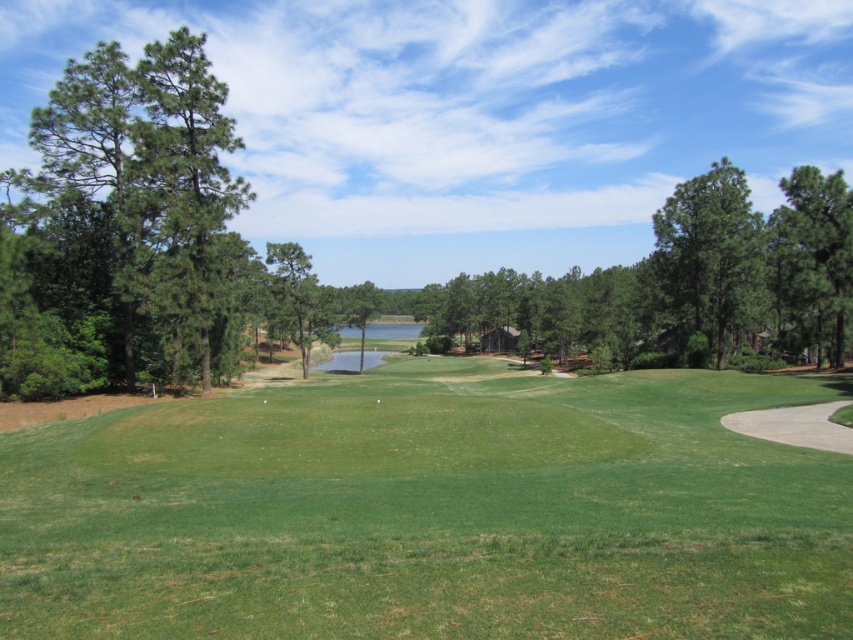
Who is shorter, green matte tree at upper right or green matte tree at center?

With less height is green matte tree at center.

Does green matte tree at upper right appear on the left side of green matte tree at center?

In fact, green matte tree at upper right is to the right of green matte tree at center.

You are a GUI agent. You are given a task and a screenshot of the screen. Output one action in this format:
    pyautogui.click(x=<x>, y=<y>)
    Task: Click on the green matte tree at upper right
    This screenshot has height=640, width=853.
    Given the screenshot: What is the action you would take?
    pyautogui.click(x=712, y=256)

Can you confirm if green leafy tree at center is positioned to the right of green matte tree at right?

No, green leafy tree at center is not to the right of green matte tree at right.

Is point (601, 285) positioned behind point (793, 228)?

Yes, point (601, 285) is farther from viewer.

Between point (700, 189) and point (793, 253), which one is positioned in front?

Point (793, 253) is more forward.

Image resolution: width=853 pixels, height=640 pixels. In order to click on green leafy tree at center in this screenshot , I will do `click(688, 278)`.

Between green matte tree at upper right and green matte tree at right, which one has more height?

Standing taller between the two is green matte tree at right.

Between point (720, 276) and point (775, 228), which one is positioned in front?

Positioned in front is point (720, 276).

Does point (735, 182) come farther from viewer compared to point (819, 291)?

Yes, point (735, 182) is farther from viewer.

Locate an element on the screen. This screenshot has width=853, height=640. green matte tree at upper right is located at coordinates (712, 256).